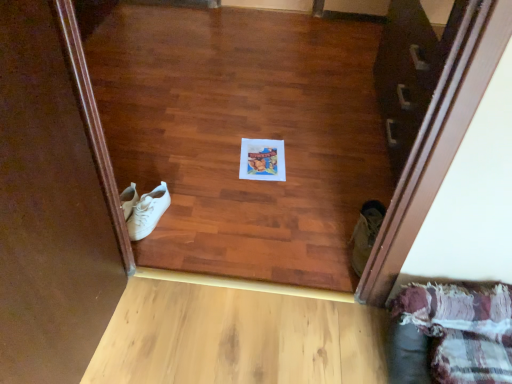
I want to click on free location in front of white leather sneakers at left, acting as the 2th footwear starting from the right, so click(162, 252).